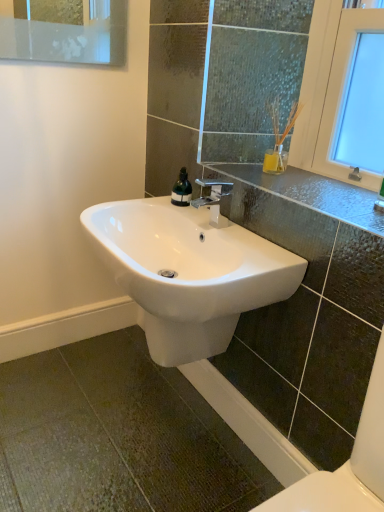
Question: From the image's perspective, is glossy ceramic sink at center over polished chrome faucet at center?

Choices:
 (A) yes
 (B) no

Answer: (A)

Question: Is polished chrome faucet at center inside glossy ceramic sink at center?

Choices:
 (A) yes
 (B) no

Answer: (B)

Question: From a real-world perspective, is glossy ceramic sink at center positioned over polished chrome faucet at center based on gravity?

Choices:
 (A) no
 (B) yes

Answer: (B)

Question: Is glossy ceramic sink at center to the left of polished chrome faucet at center from the viewer's perspective?

Choices:
 (A) no
 (B) yes

Answer: (A)

Question: Can you confirm if glossy ceramic sink at center is shorter than polished chrome faucet at center?

Choices:
 (A) no
 (B) yes

Answer: (B)

Question: In the image, is green glass soap dispenser at center positioned in front of or behind white glossy sink at center?

Choices:
 (A) front
 (B) behind

Answer: (B)

Question: In terms of size, does green glass soap dispenser at center appear bigger or smaller than white glossy sink at center?

Choices:
 (A) small
 (B) big

Answer: (A)

Question: Considering the positions of point (188, 183) and point (109, 257), is point (188, 183) closer or farther from the camera than point (109, 257)?

Choices:
 (A) farther
 (B) closer

Answer: (A)

Question: From the image's perspective, is green glass soap dispenser at center positioned above or below white glossy sink at center?

Choices:
 (A) below
 (B) above

Answer: (B)

Question: Is point (142, 248) closer or farther from the camera than point (175, 193)?

Choices:
 (A) farther
 (B) closer

Answer: (B)

Question: Is white glossy sink at center inside the boundaries of green glass soap dispenser at center, or outside?

Choices:
 (A) inside
 (B) outside

Answer: (B)

Question: In terms of width, does white glossy sink at center look wider or thinner when compared to green glass soap dispenser at center?

Choices:
 (A) thin
 (B) wide

Answer: (B)

Question: Is white glossy sink at center taller or shorter than green glass soap dispenser at center?

Choices:
 (A) tall
 (B) short

Answer: (A)

Question: From a real-world perspective, is glossy ceramic sink at center physically located above or below polished chrome faucet at center?

Choices:
 (A) below
 (B) above

Answer: (B)

Question: Looking at their shapes, would you say glossy ceramic sink at center is wider or thinner than polished chrome faucet at center?

Choices:
 (A) thin
 (B) wide

Answer: (B)